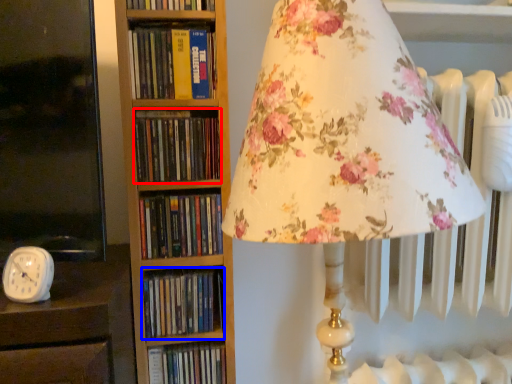
Question: Among these objects, which one is farthest to the camera, book (highlighted by a red box) or book (highlighted by a blue box)?

Choices:
 (A) book
 (B) book

Answer: (B)